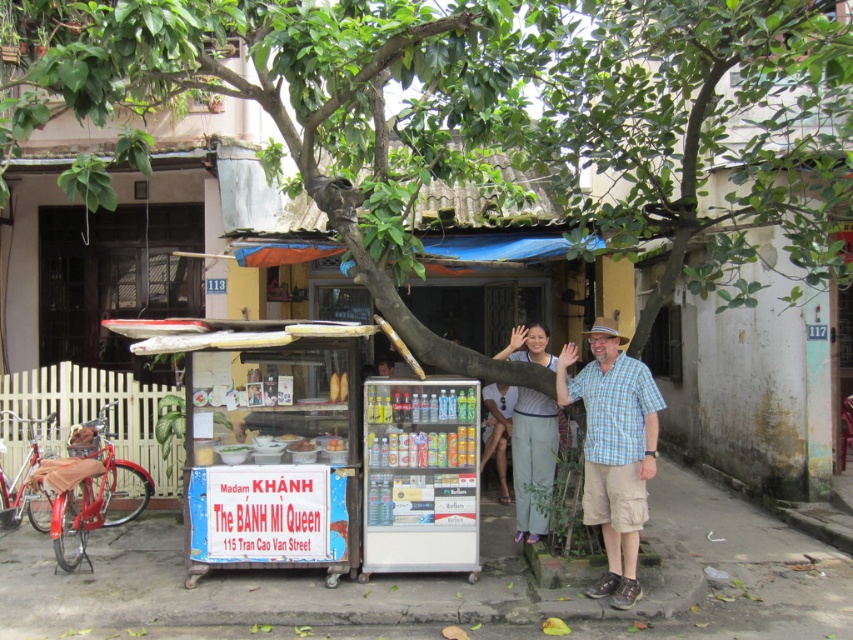
You are standing in front of the stall operated by Madam KHANH. There are two points marked in the image. Which point is closer to you, point [627,476] or point [518,426]?

Point [627,476] is closer to you than point [518,426].

You are a customer standing in front of Madam KHANH The BANH Ml Queen stall. You want to buy a shirt and pants. The plaid cotton shirt at center and light blue cotton pants at center are both displayed on a rack. Which item is closer to your right side?

The plaid cotton shirt at center is to the right of light blue cotton pants at center, so the plaid cotton shirt at center is closer to your right side.